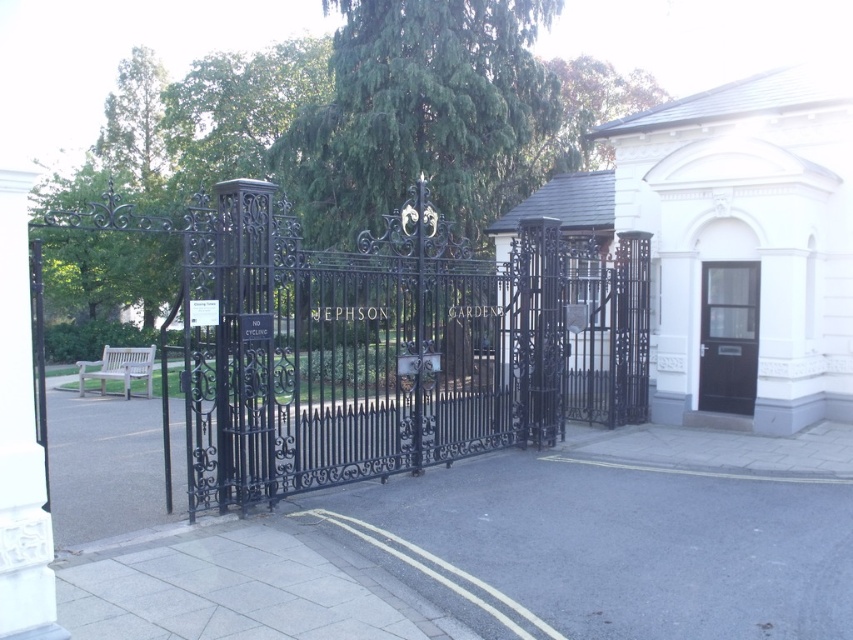
Question: Does black wrought iron gate at center appear under black wooden door at right?

Choices:
 (A) yes
 (B) no

Answer: (B)

Question: Does black wrought iron gate at center have a larger size compared to black wooden door at right?

Choices:
 (A) yes
 (B) no

Answer: (A)

Question: Observing the image, what is the correct spatial positioning of black wrought iron gate at center in reference to black wooden door at right?

Choices:
 (A) right
 (B) left

Answer: (B)

Question: Which of the following is the farthest from the observer?

Choices:
 (A) black wooden door at right
 (B) black wrought iron gate at center

Answer: (A)